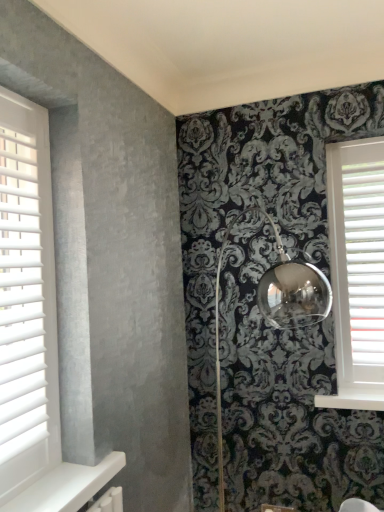
Question: Is white wood blinds at left thinner than white plastic blinds at right?

Choices:
 (A) no
 (B) yes

Answer: (A)

Question: From the image's perspective, does white wood blinds at left appear higher than white plastic blinds at right?

Choices:
 (A) yes
 (B) no

Answer: (B)

Question: Can you confirm if white wood blinds at left is smaller than white plastic blinds at right?

Choices:
 (A) no
 (B) yes

Answer: (A)

Question: Considering the relative sizes of white wood blinds at left and white plastic blinds at right in the image provided, is white wood blinds at left shorter than white plastic blinds at right?

Choices:
 (A) no
 (B) yes

Answer: (A)

Question: Is white wood blinds at left oriented away from white plastic blinds at right?

Choices:
 (A) yes
 (B) no

Answer: (B)

Question: From the image's perspective, is white painted wood at lower right above or below white wood blinds at left?

Choices:
 (A) below
 (B) above

Answer: (A)

Question: Looking at the image, does white painted wood at lower right seem bigger or smaller compared to white wood blinds at left?

Choices:
 (A) small
 (B) big

Answer: (A)

Question: In terms of width, does white painted wood at lower right look wider or thinner when compared to white wood blinds at left?

Choices:
 (A) wide
 (B) thin

Answer: (A)

Question: Is point (317, 400) closer or farther from the camera than point (54, 320)?

Choices:
 (A) closer
 (B) farther

Answer: (B)

Question: Considering the positions of white wood blinds at left and white plastic blinds at right in the image, is white wood blinds at left wider or thinner than white plastic blinds at right?

Choices:
 (A) thin
 (B) wide

Answer: (B)

Question: From the image's perspective, is white wood blinds at left positioned above or below white plastic blinds at right?

Choices:
 (A) above
 (B) below

Answer: (B)

Question: From a real-world perspective, is white wood blinds at left above or below white plastic blinds at right?

Choices:
 (A) above
 (B) below

Answer: (A)

Question: Is white wood blinds at left situated inside white plastic blinds at right or outside?

Choices:
 (A) inside
 (B) outside

Answer: (B)

Question: In terms of width, does white plastic blinds at right look wider or thinner when compared to white wood blinds at left?

Choices:
 (A) wide
 (B) thin

Answer: (B)

Question: Considering the positions of white plastic blinds at right and white wood blinds at left in the image, is white plastic blinds at right taller or shorter than white wood blinds at left?

Choices:
 (A) short
 (B) tall

Answer: (A)